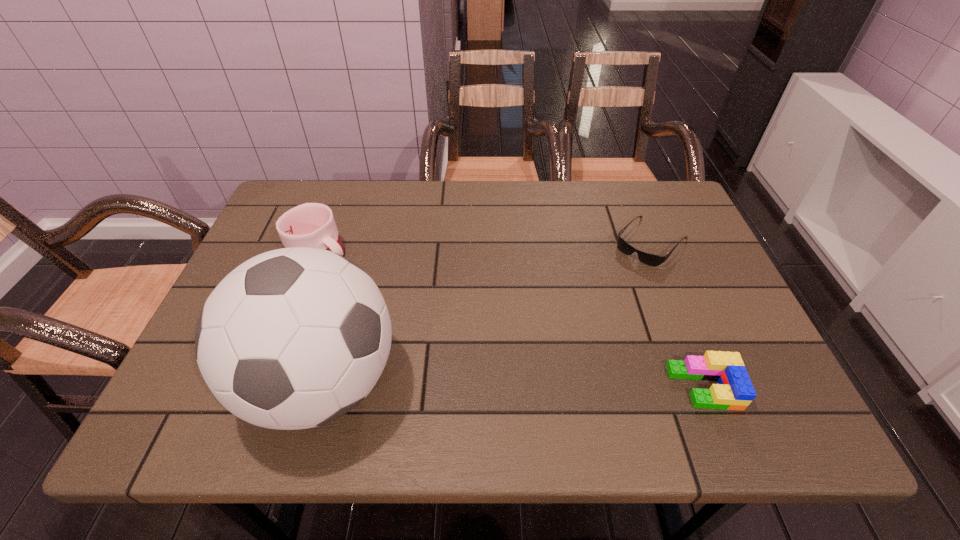
Locate an element on the screen. The height and width of the screenshot is (540, 960). free space on the desktop that is between the tallest object and the third tallest object and is positioned on the front-facing side of the shortest object is located at coordinates (516, 385).

Where is `free space on the desktop that is between the tallest object and the third tallest object and is positioned on the side with the handle of the second tallest object`? The height and width of the screenshot is (540, 960). free space on the desktop that is between the tallest object and the third tallest object and is positioned on the side with the handle of the second tallest object is located at coordinates (489, 385).